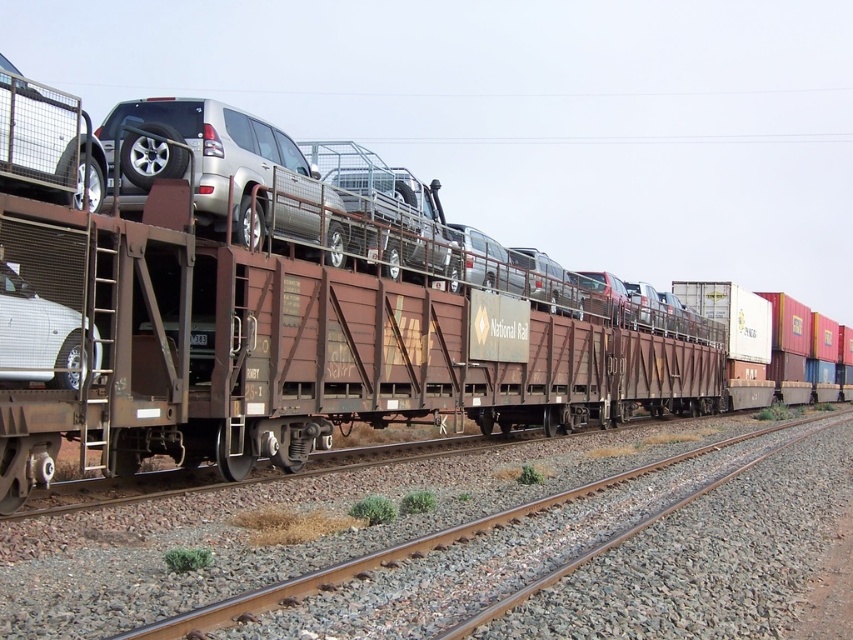
Question: Is satin silver suv at upper center bigger than brown metal train track at center?

Choices:
 (A) yes
 (B) no

Answer: (B)

Question: Which of the following is the closest to the observer?

Choices:
 (A) (0, 276)
 (B) (291, 419)
 (C) (259, 168)

Answer: (A)

Question: Is rusty metal train car at center positioned at the back of white matte sedan at left?

Choices:
 (A) yes
 (B) no

Answer: (A)

Question: Among these points, which one is farthest from the camera?

Choices:
 (A) (99, 348)
 (B) (151, 132)
 (C) (518, 506)

Answer: (C)

Question: Does brown metal train track at center appear over white matte sedan at left?

Choices:
 (A) yes
 (B) no

Answer: (B)

Question: Considering the real-world distances, which object is farthest from the satin silver suv at upper center?

Choices:
 (A) brown metal train track at center
 (B) white matte sedan at left
 (C) rusty metal train car at center

Answer: (C)